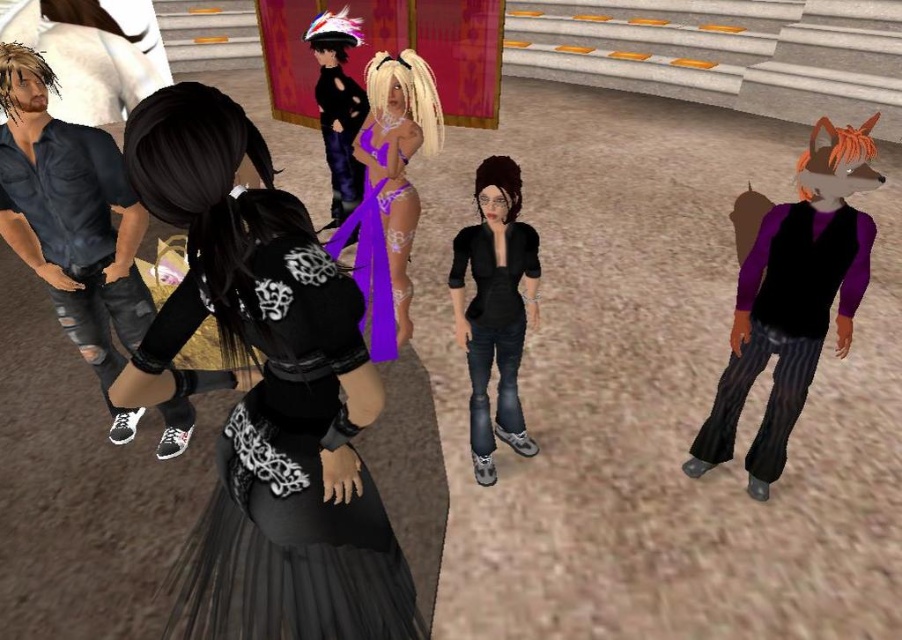
Is lace purple dress at center to the right of shiny black dress at center from the viewer's perspective?

Yes, lace purple dress at center is to the right of shiny black dress at center.

Who is more forward, [364,188] or [339,76]?

Point [364,188] is in front.

I want to click on lace purple dress at center, so click(389, 193).

Who is higher up, lace purple dress at center or matte black shirt at center?

lace purple dress at center is above.

Is point (393, 301) farther from viewer compared to point (492, 228)?

Yes, it is behind point (492, 228).

Identify the location of lace purple dress at center. The width and height of the screenshot is (902, 640). (389, 193).

Is matte black shirt at center positioned in front of purple satin dress at center?

Yes, it is in front of purple satin dress at center.

Does matte black shirt at center have a lesser height compared to purple satin dress at center?

No.

Does point (482, 406) lie in front of point (376, 180)?

Yes.

I want to click on matte black shirt at center, so click(x=495, y=308).